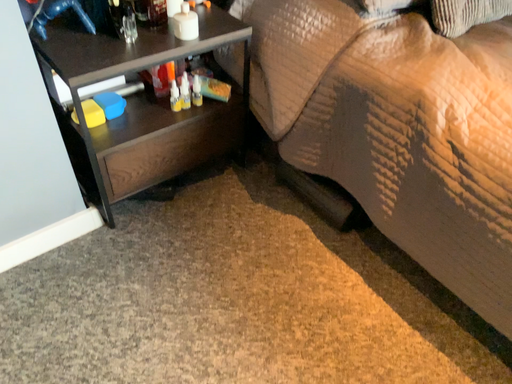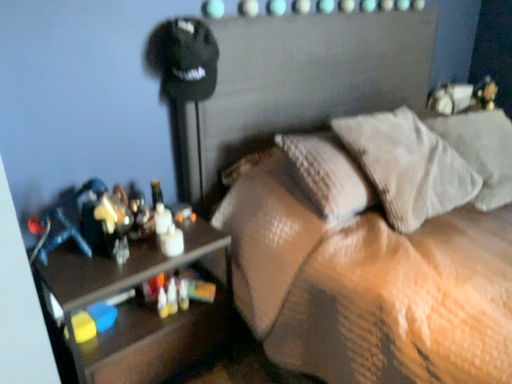
Question: How did the camera likely rotate when shooting the video?

Choices:
 (A) rotated downward
 (B) rotated upward

Answer: (B)